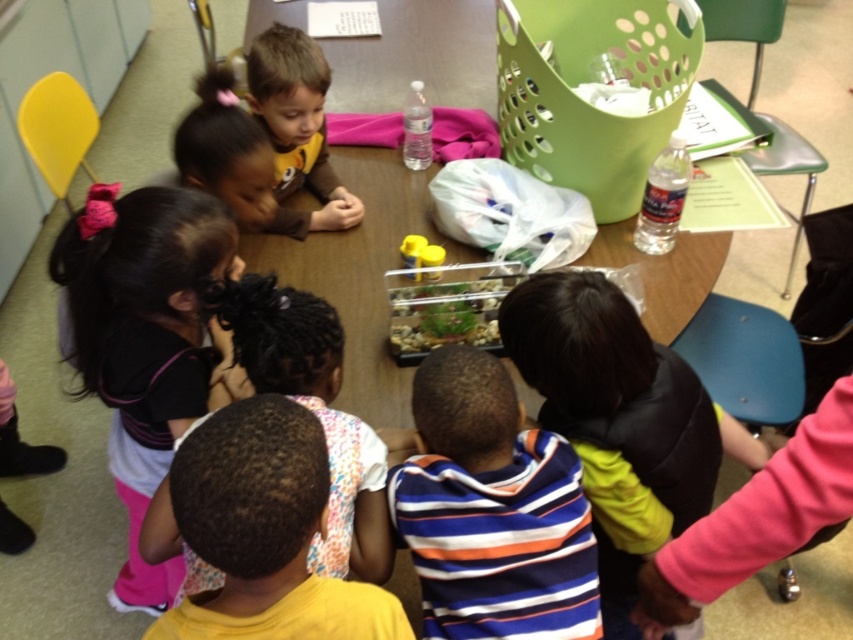
You are a teacher in a classroom. You need to place a new poster on the wall behind the wooden table at center and the transparent plastic aquarium at center. Which object should you consider the height of the poster relative to?

The wooden table at center is located above the transparent plastic aquarium at center, so you should consider the height of the poster relative to the wooden table at center to ensure it is visible over the aquarium.

You are a teacher observing the classroom scene. You need to pass a pencil to the child wearing the striped cotton shirt at center without moving the wooden table at center. Is this possible based on their positions?

The striped cotton shirt at center is behind the wooden table at center, so the teacher cannot directly reach the child without moving the table.